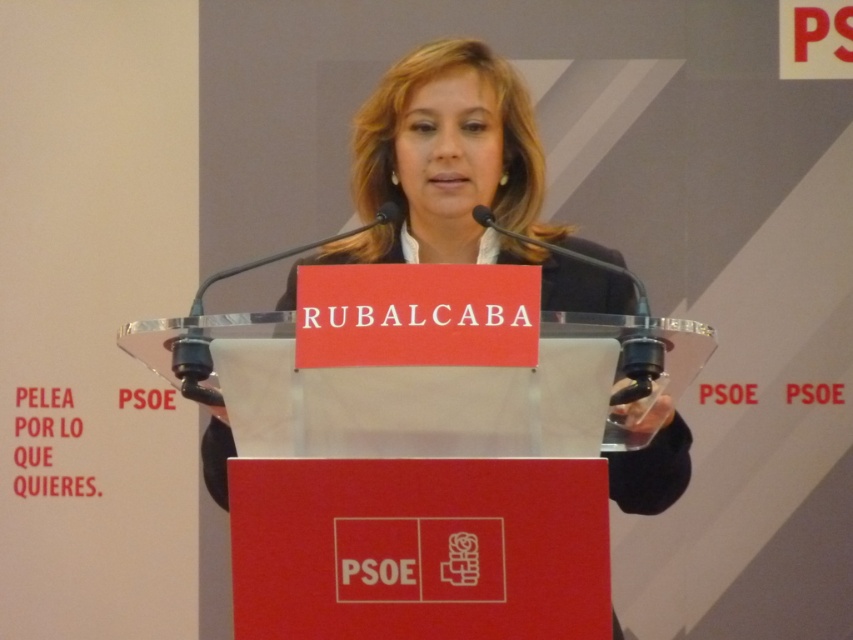
Question: Does matte black suit at center have a smaller size compared to transparent plastic podium at center?

Choices:
 (A) yes
 (B) no

Answer: (B)

Question: Does matte black suit at center have a greater width compared to transparent plastic podium at center?

Choices:
 (A) no
 (B) yes

Answer: (B)

Question: Among these points, which one is farthest from the camera?

Choices:
 (A) (560, 323)
 (B) (227, 452)

Answer: (B)

Question: Which point is closer to the camera taking this photo?

Choices:
 (A) (194, 355)
 (B) (451, 232)

Answer: (A)

Question: Is matte black suit at center thinner than transparent plastic podium at center?

Choices:
 (A) no
 (B) yes

Answer: (A)